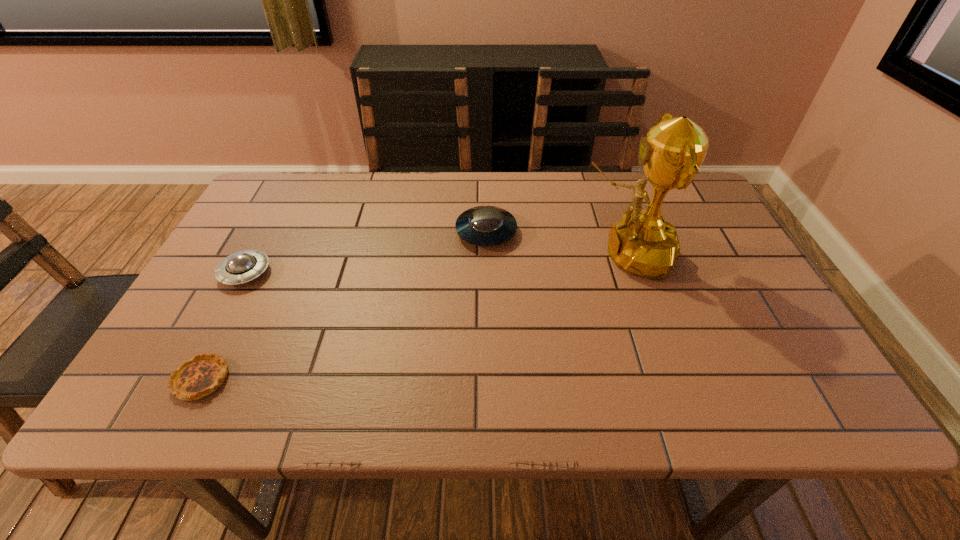
Where is `the rightmost object`? This screenshot has width=960, height=540. the rightmost object is located at coordinates (643, 243).

Locate an element on the screen. This screenshot has width=960, height=540. award is located at coordinates pos(643,243).

Identify the location of the right saucer. Image resolution: width=960 pixels, height=540 pixels. (484, 225).

At what (x,y) coordinates should I click in order to perform the action: click on the second object from right to left. Please return your answer as a coordinate pair (x, y). Looking at the image, I should click on (484, 225).

Find the location of a particular element. The height and width of the screenshot is (540, 960). the left saucer is located at coordinates (243, 266).

In order to click on quiche in this screenshot , I will do `click(202, 375)`.

Locate an element on the screen. the nearest object is located at coordinates (202, 375).

Locate an element on the screen. This screenshot has height=540, width=960. vacant space located 0.160m on the front side of the rightmost object is located at coordinates (517, 254).

What are the coordinates of `vacant space located 0.340m on the front side of the rightmost object` in the screenshot? It's located at (447, 254).

Locate an element on the screen. This screenshot has width=960, height=540. vacant space located 0.120m on the front side of the rightmost object is located at coordinates (533, 254).